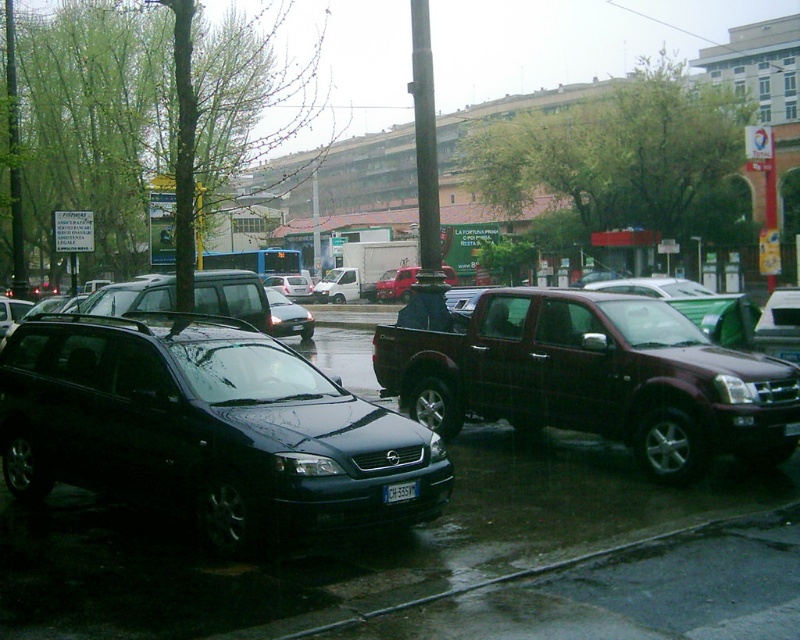
Does metallic red truck at center have a larger size compared to black plastic license plate at center?

Yes.

Is point (385, 294) positioned after point (414, 484)?

Yes, point (385, 294) is farther from viewer.

I want to click on metallic red truck at center, so click(x=396, y=284).

At what (x,y) coordinates should I click in order to perform the action: click on metallic red truck at center. Please return your answer as a coordinate pair (x, y). The image size is (800, 640). Looking at the image, I should click on (396, 284).

Is metallic red truck at center thinner than silver metallic sedan at center?

No.

Is metallic red truck at center positioned before silver metallic sedan at center?

Yes, it is.

Between point (404, 273) and point (264, 278), which one is positioned behind?

Positioned behind is point (264, 278).

Where is `metallic red truck at center`? This screenshot has height=640, width=800. metallic red truck at center is located at coordinates (396, 284).

Is silver metallic sedan at center in front of black plastic license plate at center?

That is False.

Find the location of a particular element. silver metallic sedan at center is located at coordinates (290, 285).